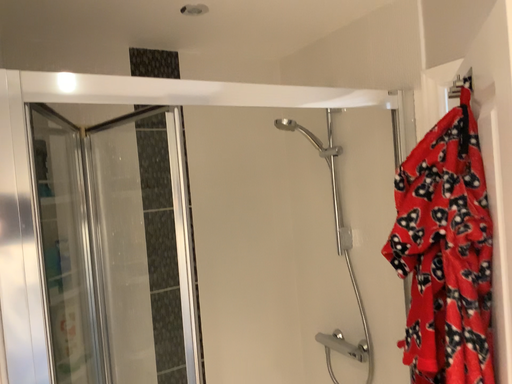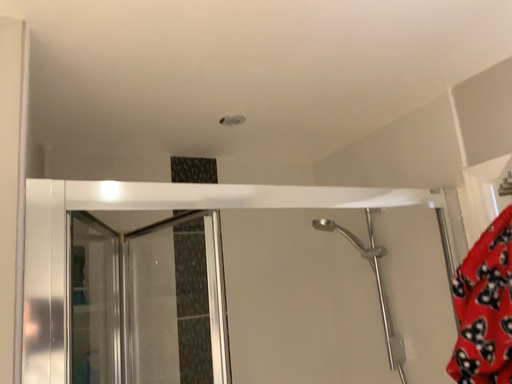
Question: Which way did the camera rotate in the video?

Choices:
 (A) rotated downward
 (B) rotated upward

Answer: (B)